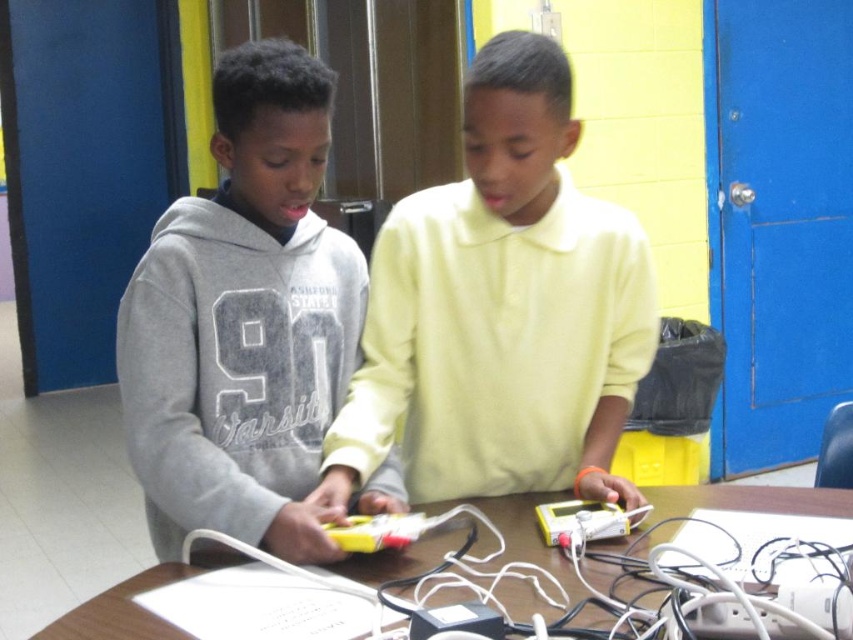
You are a tailor who needs to know the relative sizes of the gray matte hoodie at left and the wooden table at center to decide if the hoodie can be placed on the table without hanging over the edges. Can you determine which object is wider?

The gray matte hoodie at left is narrower than the wooden table at center, so it can be placed on the table without overhanging.

You are a photographer trying to capture a photo of the wooden table at center. However, the light yellow smooth shirt at center is blocking your view. Can you move the shirt to the right so that it is no longer covering the table?

The light yellow smooth shirt at center is positioned on the left side of wooden table at center. Moving it to the right would place it away from the table, allowing you to take the photo without obstruction.

You are standing in front of the boys and want to hand them a tool. The tool is on the table between the light yellow smooth shirt at center and you. Can you reach it without moving either the shirt or yourself?

The light yellow smooth shirt at center and viewer are 4.02 feet apart, so the distance between you and the shirt is 4.02 feet. Since the tool is between them, you can reach it as long as your reach spans that distance. However, typical human reach is about 2 feet, so you might need to move closer or ask for help.